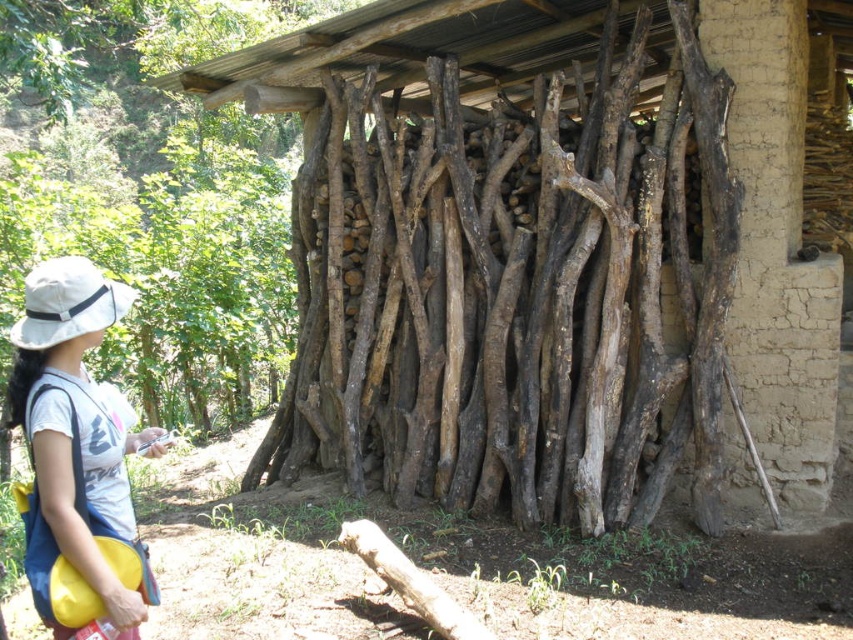
You are standing in front of the woodpile and want to place a new log between the two points labeled point (x=335, y=419) and point (x=39, y=432). Which point should you place the log closer to so that it appears closer to you?

You should place the log closer to point (x=335, y=419) because it is closer to you than point (x=39, y=432), so the log will appear closer to you when placed near that point.

You are standing in the rustic outdoor scene and see the brown rough wood at center and the white fabric hat at left. Which object is located to the right of the other?

The brown rough wood at center is positioned on the right side of white fabric hat at left.